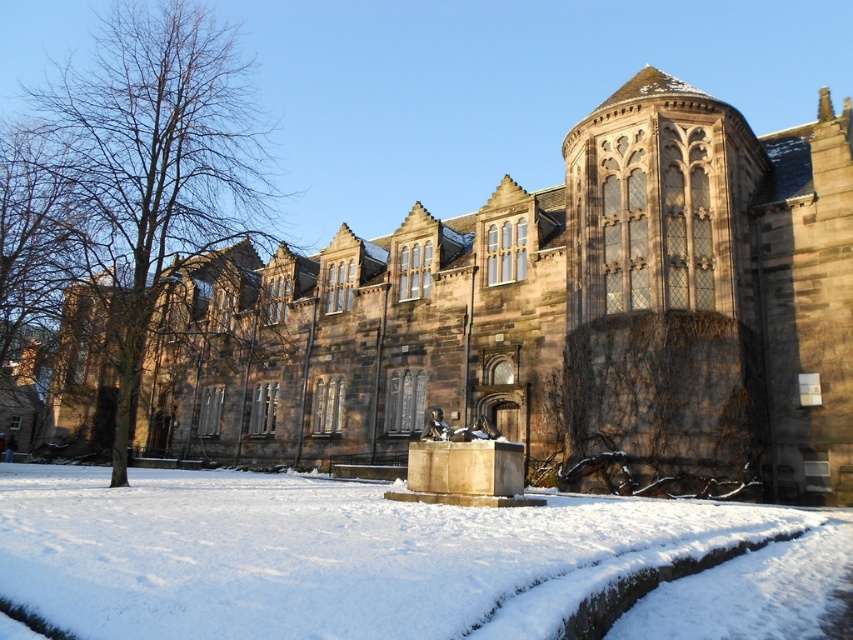
Question: Which object is the farthest from the brown bark tree at left?

Choices:
 (A) brown stone church at center
 (B) white powdery snow at center

Answer: (B)

Question: Can you confirm if brown stone church at center is positioned above brown bark tree at left?

Choices:
 (A) no
 (B) yes

Answer: (A)

Question: Among these objects, which one is farthest from the camera?

Choices:
 (A) white powdery snow at center
 (B) brown stone church at center

Answer: (B)

Question: Is brown stone church at center thinner than white powdery snow at center?

Choices:
 (A) yes
 (B) no

Answer: (B)

Question: Can you confirm if white powdery snow at center is positioned above brown bark tree at left?

Choices:
 (A) no
 (B) yes

Answer: (A)

Question: Which point is closer to the camera taking this photo?

Choices:
 (A) (201, 284)
 (B) (186, 250)

Answer: (B)